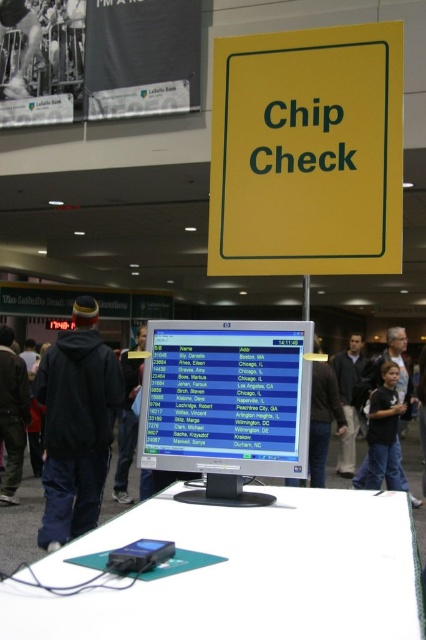
Is matte black monitor at center in front of dark blue jeans at lower right?

That is True.

Who is lower down, matte black monitor at center or dark blue jeans at lower right?

dark blue jeans at lower right is lower down.

Who is more distant from viewer, (161, 461) or (345, 403)?

Positioned behind is point (345, 403).

Where is `matte black monitor at center`? matte black monitor at center is located at coordinates (226, 403).

Is matte black monitor at center positioned before black hoodie at center?

Yes, it is.

At what (x,y) coordinates should I click in order to perform the action: click on matte black monitor at center. Please return your answer as a coordinate pair (x, y). The image size is (426, 640). Looking at the image, I should click on (226, 403).

Image resolution: width=426 pixels, height=640 pixels. Find the location of `matte black monitor at center`. matte black monitor at center is located at coordinates (226, 403).

The image size is (426, 640). Describe the element at coordinates (75, 426) in the screenshot. I see `black hoodie at center` at that location.

Which is below, black hoodie at center or black fabric shirt at center?

black fabric shirt at center is lower down.

Locate an element on the screen. Image resolution: width=426 pixels, height=640 pixels. black hoodie at center is located at coordinates (75, 426).

Locate an element on the screen. The width and height of the screenshot is (426, 640). black hoodie at center is located at coordinates (75, 426).